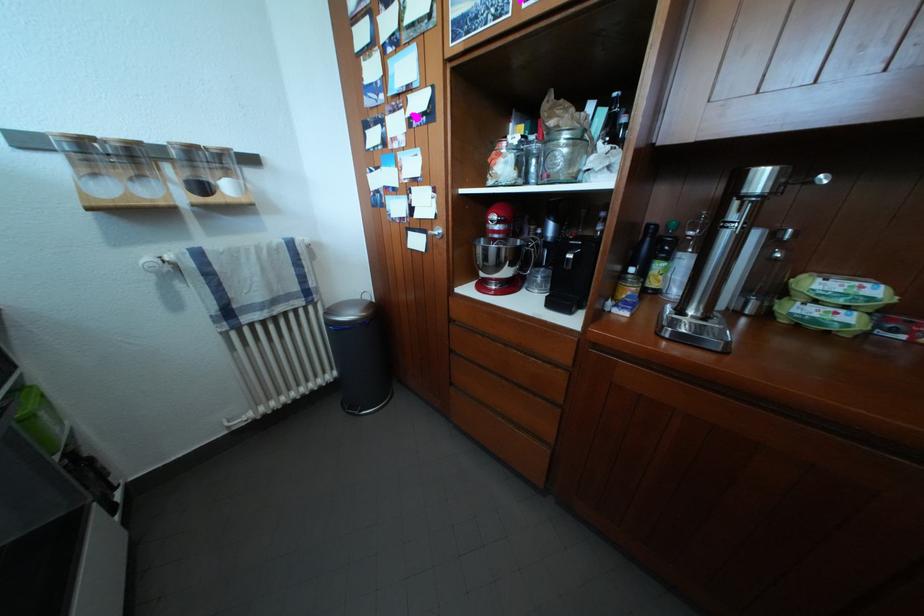
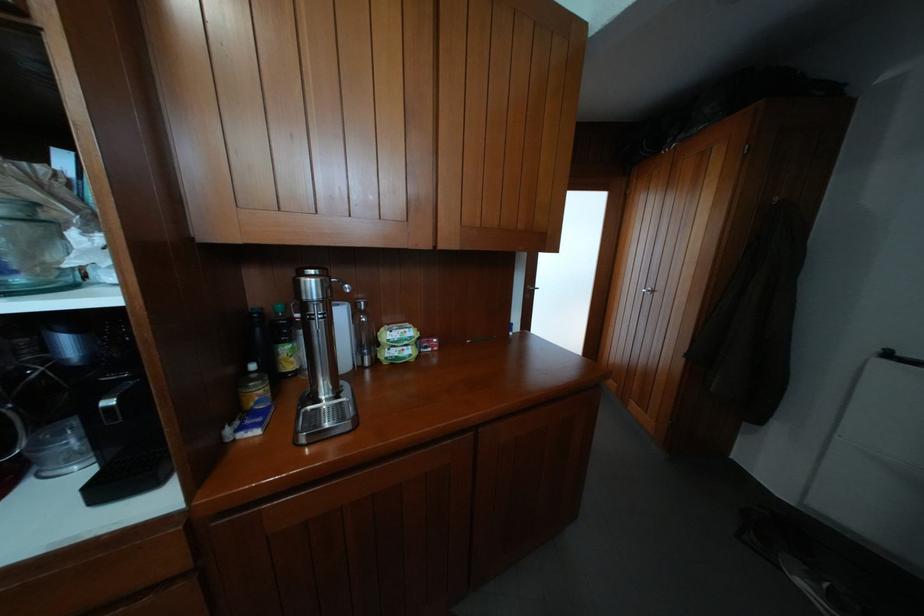
Question: The images are taken continuously from a first-person perspective. In which direction is your viewpoint rotating?

Choices:
 (A) Left
 (B) Right
 (C) Up
 (D) Down

Answer: (B)